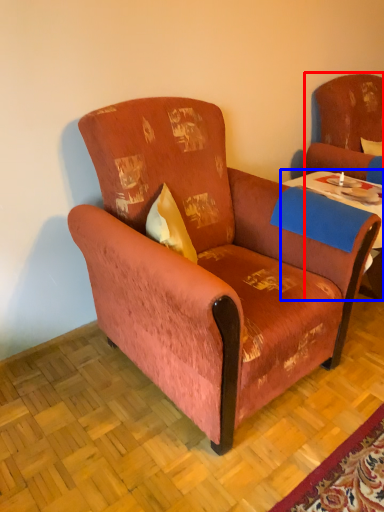
Question: Which object is closer to the camera taking this photo, swivel chair (highlighted by a red box) or table (highlighted by a blue box)?

Choices:
 (A) swivel chair
 (B) table

Answer: (B)